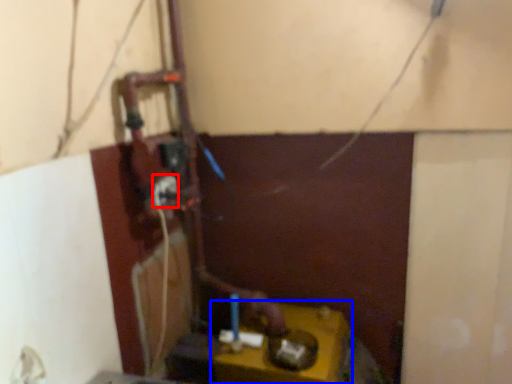
Question: Which object appears farthest to the camera in this image, power plugs and sockets (highlighted by a red box) or table (highlighted by a blue box)?

Choices:
 (A) power plugs and sockets
 (B) table

Answer: (A)